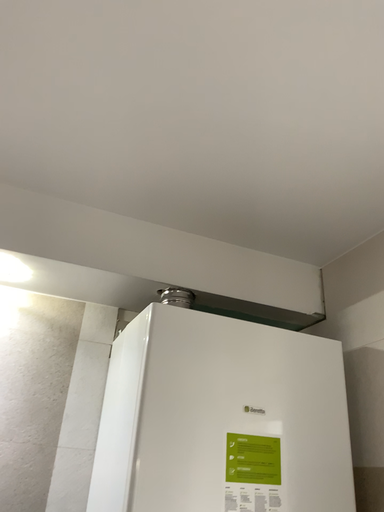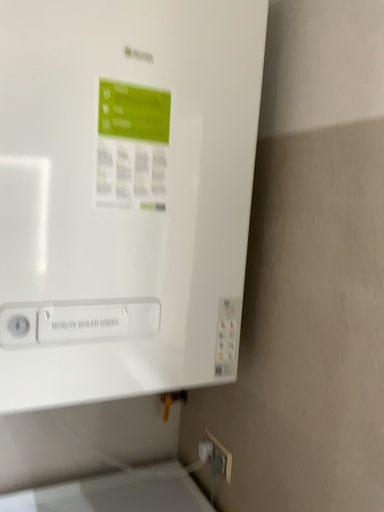
Question: How did the camera likely rotate when shooting the video?

Choices:
 (A) rotated upward
 (B) rotated downward

Answer: (B)